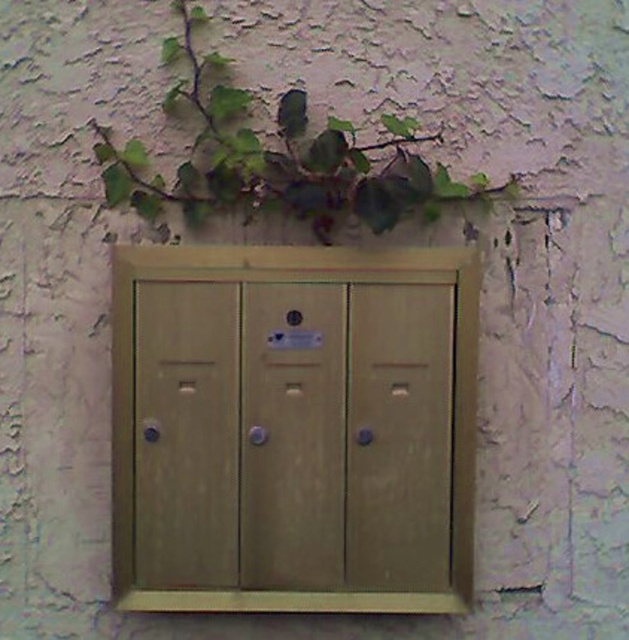
You are trying to locate the wooden locker at center and the green leafy plant at upper center on the wall. According to the scene, which object is positioned to the right side of the other?

The green leafy plant at upper center is to the right of the wooden locker at center.